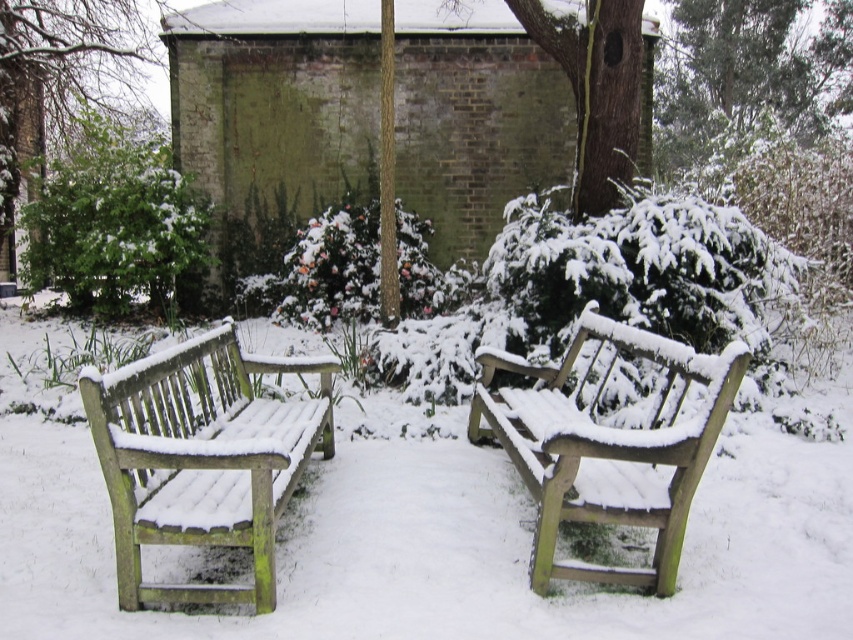
Question: Is green wood bench at left above snow-covered wood bench at center?

Choices:
 (A) yes
 (B) no

Answer: (B)

Question: Can you confirm if green wood bench at left is positioned above snow-covered wood bench at center?

Choices:
 (A) yes
 (B) no

Answer: (B)

Question: Is green wood bench at left wider than snow-covered wood bench at center?

Choices:
 (A) yes
 (B) no

Answer: (B)

Question: Which object is farther from the camera taking this photo?

Choices:
 (A) snow-covered wood bench at center
 (B) green wood bench at left

Answer: (A)

Question: Which point appears closest to the camera in this image?

Choices:
 (A) (143, 512)
 (B) (712, 435)

Answer: (B)